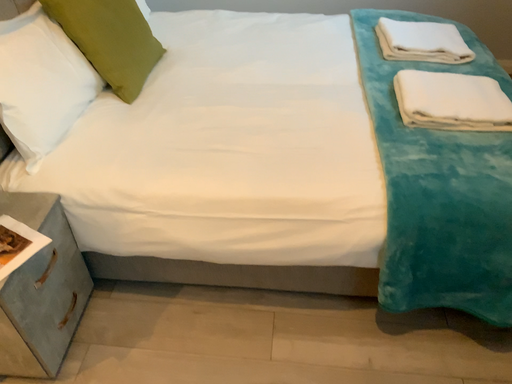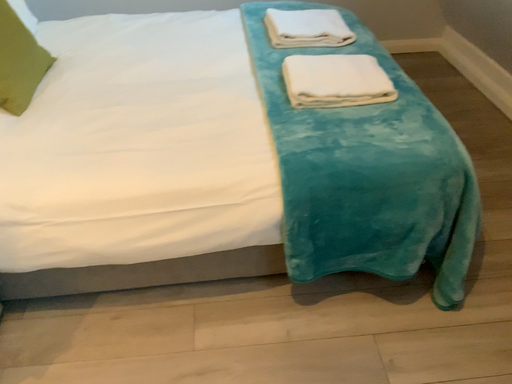
Question: How did the camera likely rotate when shooting the video?

Choices:
 (A) rotated left
 (B) rotated right

Answer: (B)